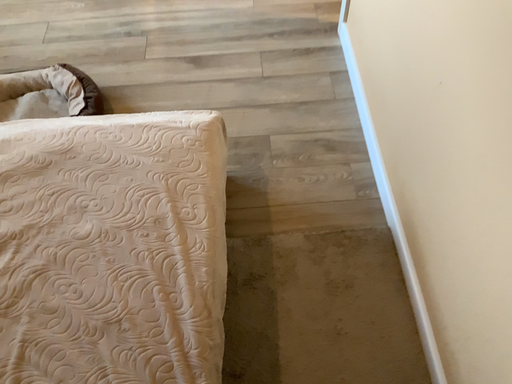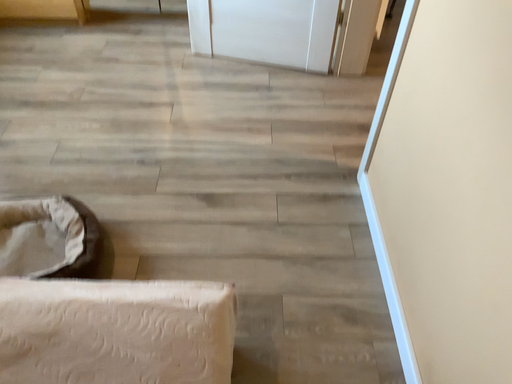
Question: Which way did the camera rotate in the video?

Choices:
 (A) rotated upward
 (B) rotated downward

Answer: (A)